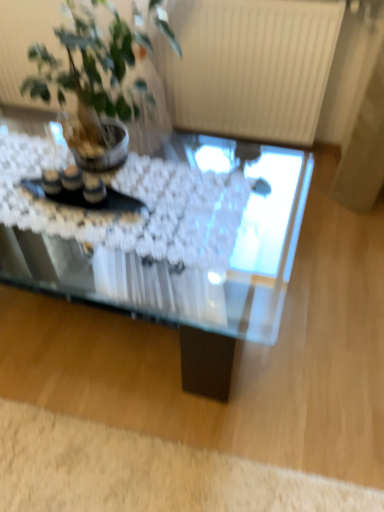
Question: Is green leafy plant at upper left next to white fluffy rug at lower left and touching it?

Choices:
 (A) no
 (B) yes

Answer: (A)

Question: Is green leafy plant at upper left aimed at white fluffy rug at lower left?

Choices:
 (A) yes
 (B) no

Answer: (B)

Question: From a real-world perspective, is green leafy plant at upper left physically below white fluffy rug at lower left?

Choices:
 (A) no
 (B) yes

Answer: (A)

Question: Considering the relative sizes of green leafy plant at upper left and white fluffy rug at lower left in the image provided, is green leafy plant at upper left bigger than white fluffy rug at lower left?

Choices:
 (A) yes
 (B) no

Answer: (A)

Question: Is green leafy plant at upper left at the right side of white fluffy rug at lower left?

Choices:
 (A) no
 (B) yes

Answer: (A)

Question: From the image's perspective, is green leafy plant at upper left positioned above or below white fluffy rug at lower left?

Choices:
 (A) below
 (B) above

Answer: (B)

Question: Is green leafy plant at upper left bigger or smaller than white fluffy rug at lower left?

Choices:
 (A) small
 (B) big

Answer: (B)

Question: Is point (155, 1) positioned closer to the camera than point (380, 503)?

Choices:
 (A) closer
 (B) farther

Answer: (A)

Question: Considering their positions, is green leafy plant at upper left located in front of or behind white fluffy rug at lower left?

Choices:
 (A) behind
 (B) front

Answer: (B)

Question: Is transparent glass coffee table at center situated inside white fluffy rug at lower left or outside?

Choices:
 (A) outside
 (B) inside

Answer: (A)

Question: Does point (162, 271) appear closer or farther from the camera than point (261, 503)?

Choices:
 (A) closer
 (B) farther

Answer: (A)

Question: In terms of height, does transparent glass coffee table at center look taller or shorter compared to white fluffy rug at lower left?

Choices:
 (A) short
 (B) tall

Answer: (B)

Question: In terms of width, does transparent glass coffee table at center look wider or thinner when compared to white fluffy rug at lower left?

Choices:
 (A) wide
 (B) thin

Answer: (A)

Question: From the image's perspective, is transparent glass coffee table at center located above or below green leafy plant at upper left?

Choices:
 (A) below
 (B) above

Answer: (A)

Question: Considering the positions of transparent glass coffee table at center and green leafy plant at upper left in the image, is transparent glass coffee table at center bigger or smaller than green leafy plant at upper left?

Choices:
 (A) big
 (B) small

Answer: (A)